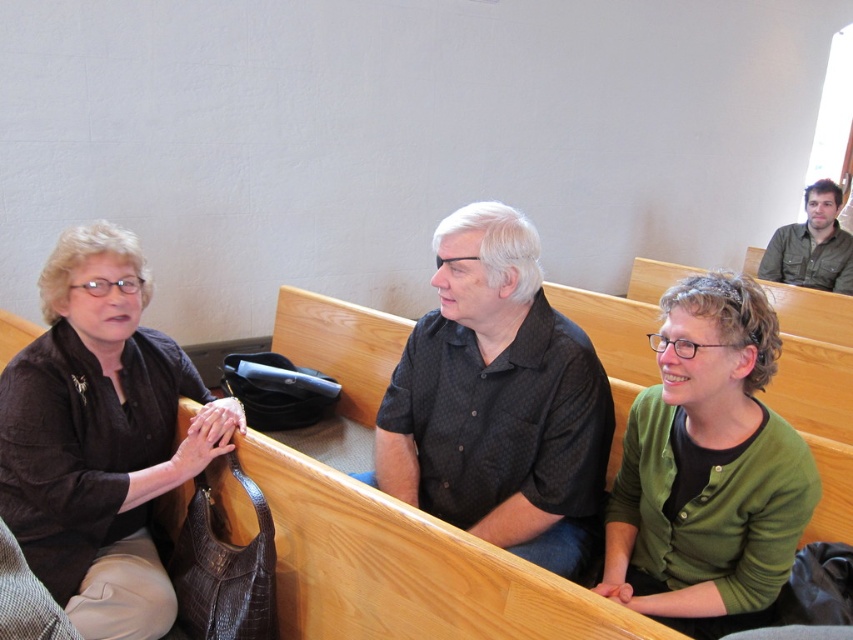
What is the object located at the coordinates point (100, 436) in the image?

The object located at point (100, 436) is a matte brown purse at left.

You are organizing a small event and need to place a 30 cm wide decorative item on the pew. Given the space occupied by the matte brown purse at left and the green textured shirt at upper right, which object would allow enough space for the item?

The matte brown purse at left has a larger width than the green textured shirt at upper right, so placing the 30 cm wide decorative item next to the green textured shirt at upper right would provide sufficient space since it occupies less width.